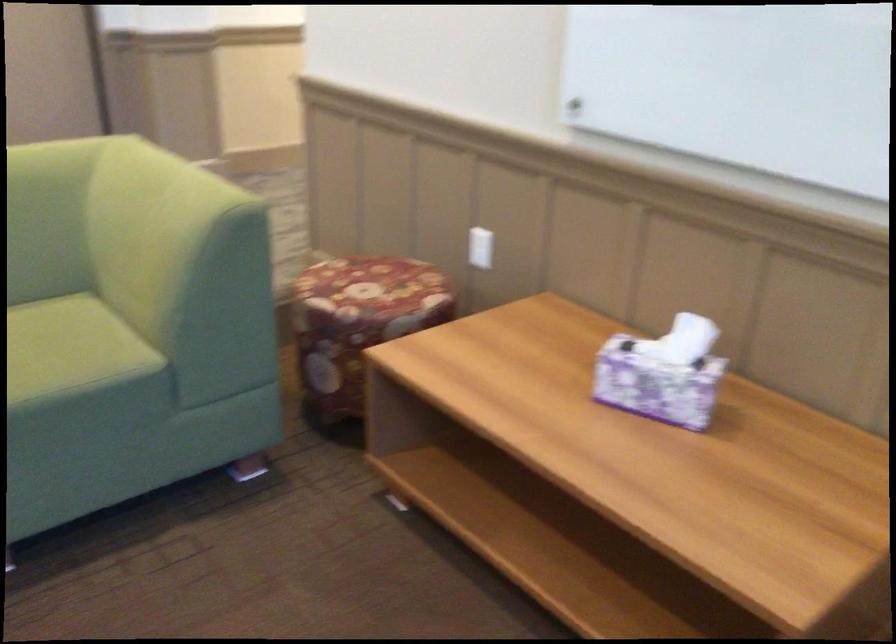
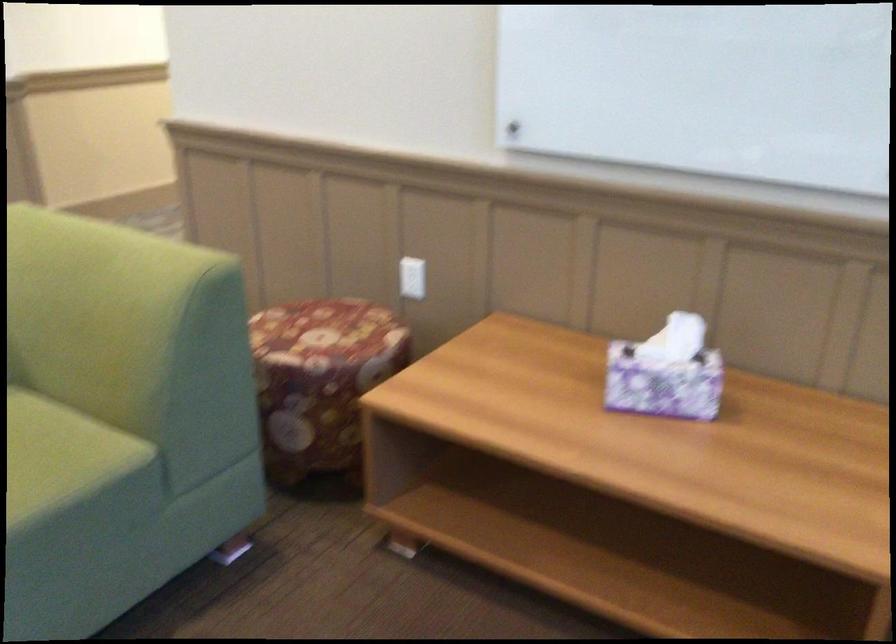
Question: The camera is either moving clockwise (left) or counter-clockwise (right) around the object. The first image is from the beginning of the video and the second image is from the end. Is the camera moving left or right when shooting the video?

Choices:
 (A) Left
 (B) Right

Answer: (A)